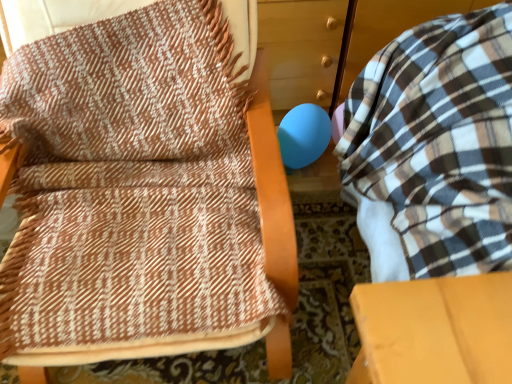
Question: From a real-world perspective, is brown woven blanket at upper left beneath matte blue balloon at center?

Choices:
 (A) yes
 (B) no

Answer: (B)

Question: Is the depth of brown woven blanket at upper left greater than that of matte blue balloon at center?

Choices:
 (A) yes
 (B) no

Answer: (B)

Question: Is brown woven blanket at upper left shorter than matte blue balloon at center?

Choices:
 (A) yes
 (B) no

Answer: (B)

Question: Is brown woven blanket at upper left turned away from matte blue balloon at center?

Choices:
 (A) no
 (B) yes

Answer: (A)

Question: Is brown woven blanket at upper left aimed at matte blue balloon at center?

Choices:
 (A) yes
 (B) no

Answer: (B)

Question: Does brown woven blanket at upper left have a smaller size compared to matte blue balloon at center?

Choices:
 (A) yes
 (B) no

Answer: (B)

Question: Does matte blue balloon at center have a greater width compared to plaid fabric bean bag at right?

Choices:
 (A) no
 (B) yes

Answer: (A)

Question: Does matte blue balloon at center have a lesser height compared to plaid fabric bean bag at right?

Choices:
 (A) no
 (B) yes

Answer: (B)

Question: Is matte blue balloon at center next to plaid fabric bean bag at right and touching it?

Choices:
 (A) yes
 (B) no

Answer: (B)

Question: Considering the relative sizes of matte blue balloon at center and plaid fabric bean bag at right in the image provided, is matte blue balloon at center taller than plaid fabric bean bag at right?

Choices:
 (A) no
 (B) yes

Answer: (A)

Question: From a real-world perspective, is matte blue balloon at center over plaid fabric bean bag at right?

Choices:
 (A) yes
 (B) no

Answer: (B)

Question: Is plaid fabric bean bag at right at the back of matte blue balloon at center?

Choices:
 (A) yes
 (B) no

Answer: (B)

Question: From the image's perspective, is brown woven blanket at upper left located beneath plaid fabric bean bag at right?

Choices:
 (A) no
 (B) yes

Answer: (A)